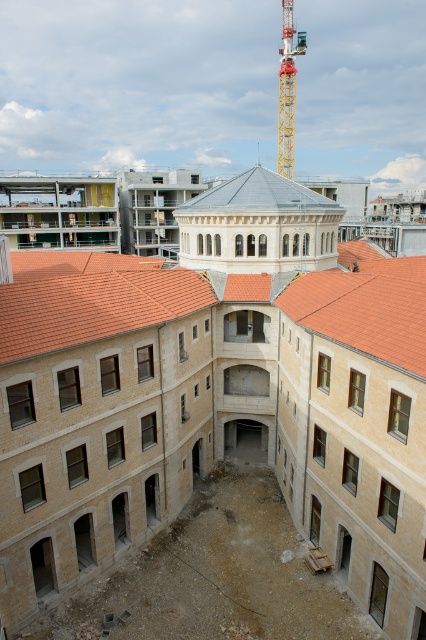
Does beige stone construction site at center have a lesser height compared to orange tile roof at center?

No.

Which of these two, beige stone construction site at center or orange tile roof at center, stands shorter?

orange tile roof at center is shorter.

Is point (152, 465) farther from viewer compared to point (348, 284)?

Yes, point (152, 465) is behind point (348, 284).

Find the location of `beige stone construction site at center`. beige stone construction site at center is located at coordinates 215,401.

Which is more to the left, white stone tower at center or smooth gray dome at center?

white stone tower at center

Image resolution: width=426 pixels, height=640 pixels. What do you see at coordinates (259, 225) in the screenshot?
I see `white stone tower at center` at bounding box center [259, 225].

This screenshot has height=640, width=426. I want to click on white stone tower at center, so click(x=259, y=225).

Can you confirm if white stone tower at center is positioned below yellow metallic crane at upper center?

A: Yes, white stone tower at center is below yellow metallic crane at upper center.

Is white stone tower at center positioned before yellow metallic crane at upper center?

Yes, it is.

Is point (316, 268) positioned after point (290, 115)?

No.

Identify the location of white stone tower at center. This screenshot has width=426, height=640. (259, 225).